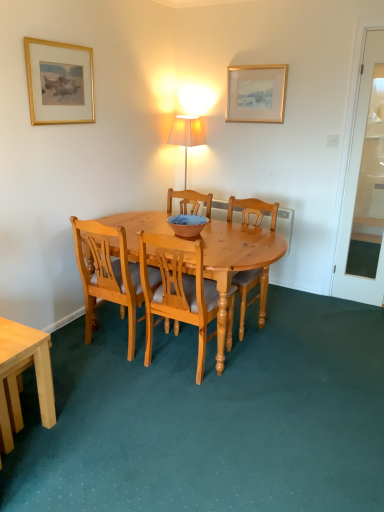
I want to click on gold-framed picture at upper left, the 2th picture frame in the right-to-left sequence, so click(x=59, y=82).

This screenshot has width=384, height=512. I want to click on blue and white ceramic bowl at center, so click(x=187, y=224).

From the image's perspective, which is above, blue and white ceramic bowl at center or gold-framed picture at upper left, which is counted as the second picture frame, starting from the back?

gold-framed picture at upper left, which is counted as the second picture frame, starting from the back, from the image's perspective.

Is blue and white ceramic bowl at center looking in the opposite direction of gold-framed picture at upper left, the 2th picture frame in the right-to-left sequence?

No, blue and white ceramic bowl at center is not facing the opposite direction of gold-framed picture at upper left, the 2th picture frame in the right-to-left sequence.

Would you say blue and white ceramic bowl at center is to the left or to the right of gold-framed picture at upper left, which is the 1th picture frame in front-to-back order, in the picture?

Based on their positions, blue and white ceramic bowl at center is located to the right of gold-framed picture at upper left, which is the 1th picture frame in front-to-back order.

Is light brown wooden desk at lower left in contact with light brown wood chair at center, the third chair in the right-to-left sequence?

light brown wooden desk at lower left is not next to light brown wood chair at center, the third chair in the right-to-left sequence, and they're not touching.

Considering the points (34, 330) and (133, 344), which point is in front, point (34, 330) or point (133, 344)?

The point (34, 330) is in front.

Considering their positions, is light brown wooden desk at lower left located in front of or behind light brown wood chair at center, the third chair in the right-to-left sequence?

In the image, light brown wooden desk at lower left appears in front of light brown wood chair at center, the third chair in the right-to-left sequence.

How different are the orientations of light brown wooden desk at lower left and light brown wood chair at center, which is counted as the 1th chair, starting from the left, in degrees?

They differ by 88.9 degrees in their facing directions.

Considering the sizes of gold framed picture at upper center, marked as the first picture frame in a right-to-left arrangement, and light brown wood chair at center, which is counted as the 1th chair, starting from the left, in the image, is gold framed picture at upper center, marked as the first picture frame in a right-to-left arrangement, taller or shorter than light brown wood chair at center, which is counted as the 1th chair, starting from the left,?

gold framed picture at upper center, marked as the first picture frame in a right-to-left arrangement, is shorter than light brown wood chair at center, which is counted as the 1th chair, starting from the left.

How much distance is there between gold framed picture at upper center, the 2th picture frame positioned from the left, and light brown wood chair at center, the third chair in the right-to-left sequence?

gold framed picture at upper center, the 2th picture frame positioned from the left, and light brown wood chair at center, the third chair in the right-to-left sequence, are 5.92 feet apart.

Visually, is gold framed picture at upper center, the 2th picture frame positioned from the left, positioned to the left or to the right of light brown wood chair at center, the third chair in the right-to-left sequence?

Clearly, gold framed picture at upper center, the 2th picture frame positioned from the left, is on the right of light brown wood chair at center, the third chair in the right-to-left sequence, in the image.

Are gold framed picture at upper center, the 2th picture frame positioned from the left, and light brown wood chair at center, which is counted as the 1th chair, starting from the left, beside each other?

gold framed picture at upper center, the 2th picture frame positioned from the left, is not next to light brown wood chair at center, which is counted as the 1th chair, starting from the left, and they're not touching.

Between gold-framed picture at upper left, the 2th picture frame in the right-to-left sequence, and light brown wooden chair at center, arranged as the third chair when viewed from the left, which one has more height?

light brown wooden chair at center, arranged as the third chair when viewed from the left.

Considering the positions of point (73, 60) and point (261, 210), is point (73, 60) closer or farther from the camera than point (261, 210)?

Point (73, 60).

Can you see gold-framed picture at upper left, which is the 1th picture frame in front-to-back order, touching light brown wooden chair at center, positioned as the 1th chair in right-to-left order?

No, gold-framed picture at upper left, which is the 1th picture frame in front-to-back order, is not making contact with light brown wooden chair at center, positioned as the 1th chair in right-to-left order.

Is gold-framed picture at upper left, which is the 1th picture frame in front-to-back order, behind light brown wooden chair at center, positioned as the 1th chair in right-to-left order?

No, it is not.

Is light brown wood chair at center, the third chair in the right-to-left sequence, situated inside blue and white ceramic bowl at center or outside?

light brown wood chair at center, the third chair in the right-to-left sequence, is outside blue and white ceramic bowl at center.

Is point (150, 274) farther from viewer compared to point (196, 228)?

Yes, it is behind point (196, 228).

Can you confirm if light brown wood chair at center, the third chair in the right-to-left sequence, is positioned to the right of blue and white ceramic bowl at center?

In fact, light brown wood chair at center, the third chair in the right-to-left sequence, is to the left of blue and white ceramic bowl at center.

Does light brown wood chair at center, which is counted as the 1th chair, starting from the left, have a larger size compared to blue and white ceramic bowl at center?

Yes.

Is point (1, 435) positioned before point (260, 120)?

Yes, it is in front of point (260, 120).

Locate an element on the screen. Image resolution: width=384 pixels, height=512 pixels. desk below the gold framed picture at upper center, marked as the first picture frame in a right-to-left arrangement (from the image's perspective) is located at coordinates (20, 377).

Consider the image. From the image's perspective, is light brown wooden desk at lower left over gold framed picture at upper center, the first picture frame viewed from the back?

No.

From a real-world perspective, is light brown wooden desk at lower left positioned under gold framed picture at upper center, the 2th picture frame positioned from the left, based on gravity?

Yes.

Considering the relative sizes of light wood chair at center, which appears as the second chair when viewed from the left, and blue and white ceramic bowl at center in the image provided, is light wood chair at center, which appears as the second chair when viewed from the left, smaller than blue and white ceramic bowl at center?

Actually, light wood chair at center, which appears as the second chair when viewed from the left, might be larger than blue and white ceramic bowl at center.

How many degrees apart are the facing directions of light wood chair at center, which is the 2th chair in right-to-left order, and blue and white ceramic bowl at center?

The angular difference between light wood chair at center, which is the 2th chair in right-to-left order, and blue and white ceramic bowl at center is 90.2 degrees.

Looking at this image, which object is positioned more to the right, light wood chair at center, which is the 2th chair in right-to-left order, or blue and white ceramic bowl at center?

light wood chair at center, which is the 2th chair in right-to-left order, is more to the right.

Which object is further away from the camera, light wood chair at center, which appears as the second chair when viewed from the left, or blue and white ceramic bowl at center?

blue and white ceramic bowl at center is further away from the camera.

At what (x,y) coordinates should I click in order to perform the action: click on bowl located on the right of gold-framed picture at upper left, which is the 1th picture frame in front-to-back order. Please return your answer as a coordinate pair (x, y). Looking at the image, I should click on (187, 224).

This screenshot has width=384, height=512. I want to click on desk lying in front of the light brown wood chair at center, which is counted as the 1th chair, starting from the left, so click(x=20, y=377).

Estimate the real-world distances between objects in this image. Which object is further from gold-framed picture at upper left, which is the 1th picture frame in front-to-back order, light brown wooden desk at lower left or light wood chair at center, which appears as the second chair when viewed from the left?

light brown wooden desk at lower left lies further to gold-framed picture at upper left, which is the 1th picture frame in front-to-back order, than the other object.

Which object lies further to the anchor point light brown wooden desk at lower left, blue and white ceramic bowl at center or gold-framed picture at upper left, which is the 1th picture frame in front-to-back order?

gold-framed picture at upper left, which is the 1th picture frame in front-to-back order.

Estimate the real-world distances between objects in this image. Which object is further from gold framed picture at upper center, which ranks as the second picture frame in front-to-back order, light brown wooden chair at center, positioned as the 1th chair in right-to-left order, or light wood chair at center, which is the 2th chair in right-to-left order?

light wood chair at center, which is the 2th chair in right-to-left order, lies further to gold framed picture at upper center, which ranks as the second picture frame in front-to-back order, than the other object.

Based on the photo, estimate the real-world distances between objects in this image. Which object is further from light brown wood chair at center, the third chair in the right-to-left sequence, light brown wooden desk at lower left or gold framed picture at upper center, the 2th picture frame positioned from the left?

The object further to light brown wood chair at center, the third chair in the right-to-left sequence, is gold framed picture at upper center, the 2th picture frame positioned from the left.

Based on their spatial positions, is light brown wood chair at center, which is counted as the 1th chair, starting from the left, or light wood chair at center, which is the 2th chair in right-to-left order, further from blue and white ceramic bowl at center?

The object further to blue and white ceramic bowl at center is light brown wood chair at center, which is counted as the 1th chair, starting from the left.

Looking at the image, which one is located closer to blue and white ceramic bowl at center, light brown wood chair at center, the third chair in the right-to-left sequence, or gold-framed picture at upper left, the 2th picture frame in the right-to-left sequence?

The object closer to blue and white ceramic bowl at center is light brown wood chair at center, the third chair in the right-to-left sequence.

When comparing their distances from gold-framed picture at upper left, the 2th picture frame in the right-to-left sequence, does light brown wood chair at center, which is counted as the 1th chair, starting from the left, or blue and white ceramic bowl at center seem further?

blue and white ceramic bowl at center is positioned further to the anchor gold-framed picture at upper left, the 2th picture frame in the right-to-left sequence.

Looking at the image, which one is located further to gold framed picture at upper center, which ranks as the second picture frame in front-to-back order, light brown wooden desk at lower left or light brown wood chair at center, the third chair in the right-to-left sequence?

light brown wooden desk at lower left is positioned further to the anchor gold framed picture at upper center, which ranks as the second picture frame in front-to-back order.

The width and height of the screenshot is (384, 512). Find the location of `bowl that lies between gold framed picture at upper center, marked as the first picture frame in a right-to-left arrangement, and light brown wooden chair at center, positioned as the 1th chair in right-to-left order, from top to bottom`. bowl that lies between gold framed picture at upper center, marked as the first picture frame in a right-to-left arrangement, and light brown wooden chair at center, positioned as the 1th chair in right-to-left order, from top to bottom is located at coordinates (187, 224).

The image size is (384, 512). In order to click on bowl between gold-framed picture at upper left, the 2th picture frame in the right-to-left sequence, and light wood chair at center, which is the 2th chair in right-to-left order, in the vertical direction in this screenshot , I will do `click(187, 224)`.

Locate an element on the screen. This screenshot has height=512, width=384. bowl between gold framed picture at upper center, the first picture frame viewed from the back, and light brown wooden desk at lower left, in the vertical direction is located at coordinates (187, 224).

The image size is (384, 512). What are the coordinates of `picture frame between gold framed picture at upper center, which ranks as the second picture frame in front-to-back order, and light wood chair at center, which appears as the second chair when viewed from the left, vertically` in the screenshot? It's located at (59, 82).